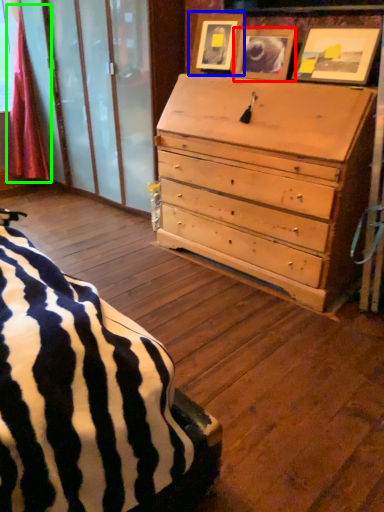
Question: Which object is positioned closest to picture frame (highlighted by a red box)? Select from picture frame (highlighted by a blue box) and curtain (highlighted by a green box).

Choices:
 (A) picture frame
 (B) curtain

Answer: (A)